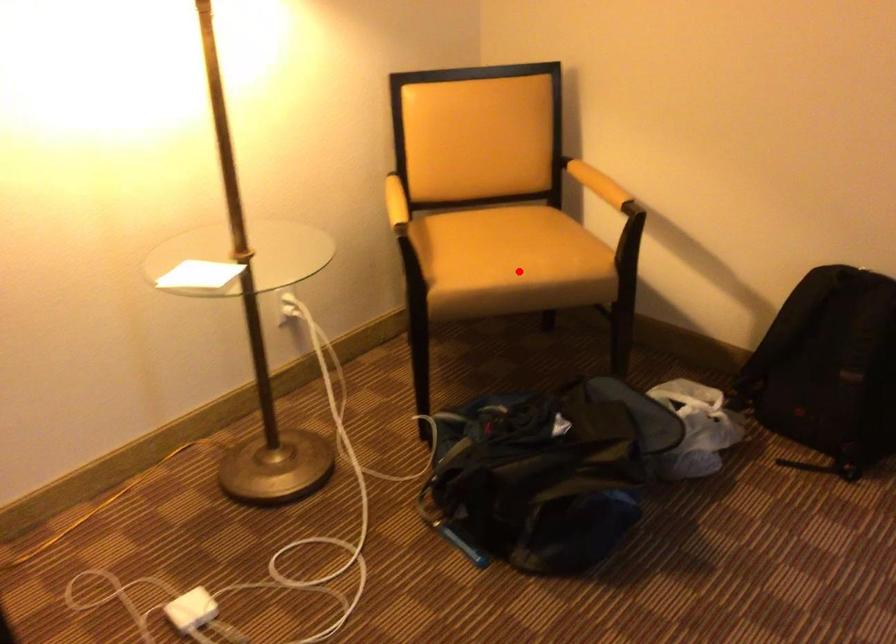
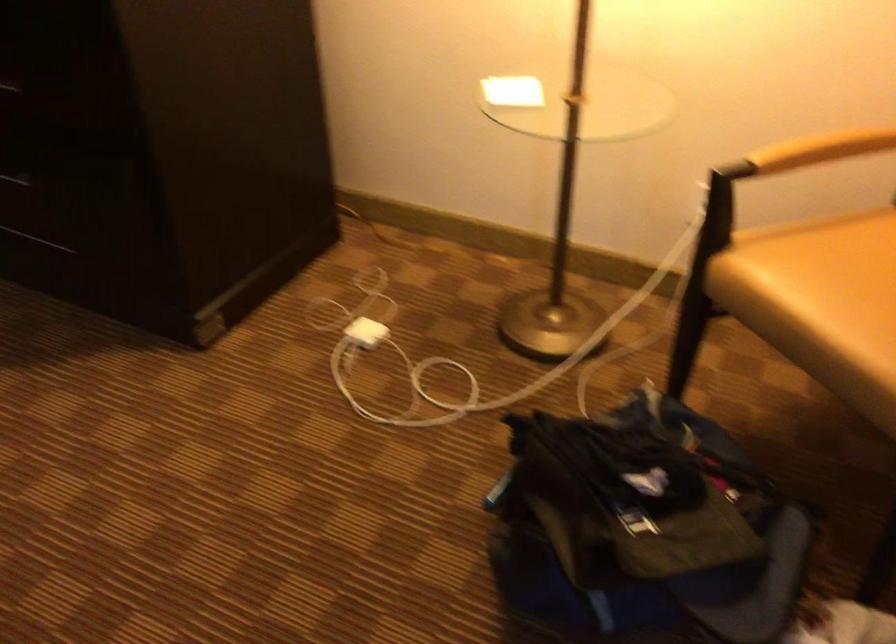
The point at the highlighted location is marked in the first image. Where is the corresponding point in the second image?

(821, 303)